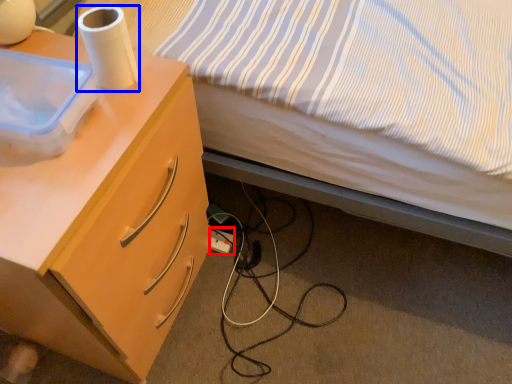
Question: Which object appears farthest to the camera in this image, power outlet (highlighted by a red box) or paper towel (highlighted by a blue box)?

Choices:
 (A) power outlet
 (B) paper towel

Answer: (A)